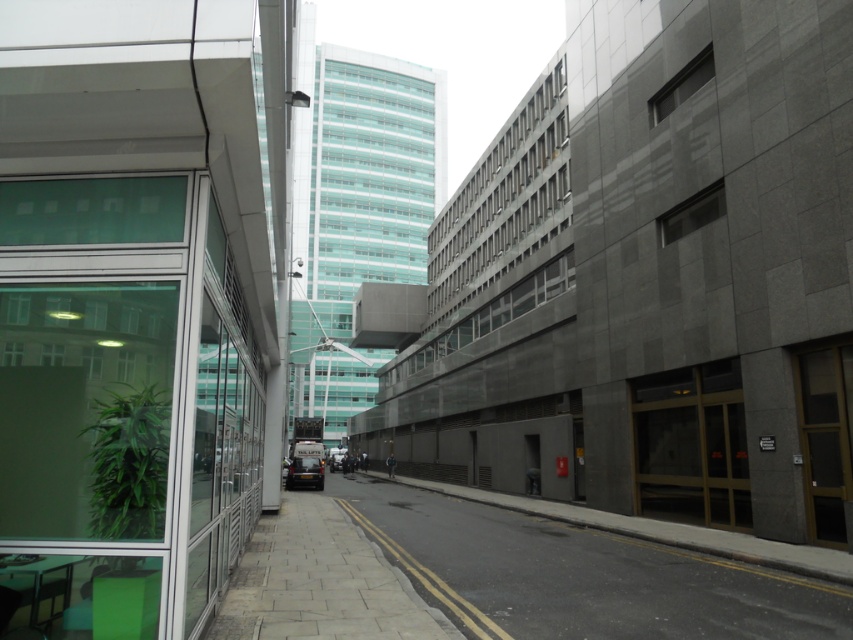
Between smooth concrete pavement at center and metallic silver van at center, which one appears on the left side from the viewer's perspective?

metallic silver van at center is more to the left.

Does smooth concrete pavement at center appear over metallic silver van at center?

Correct, smooth concrete pavement at center is located above metallic silver van at center.

Is point (350, 509) positioned behind point (314, 476)?

No, (350, 509) is closer to viewer.

Identify the location of smooth concrete pavement at center. click(x=579, y=577).

Consider the image. Does paved stone sidewalk at lower left come in front of metallic silver van at center?

Yes.

In order to click on paved stone sidewalk at lower left in this screenshot , I will do (x=321, y=582).

At what (x,y) coordinates should I click in order to perform the action: click on paved stone sidewalk at lower left. Please return your answer as a coordinate pair (x, y). Looking at the image, I should click on (321, 582).

Who is positioned more to the right, smooth concrete pavement at center or paved stone sidewalk at lower left?

From the viewer's perspective, smooth concrete pavement at center appears more on the right side.

Between smooth concrete pavement at center and paved stone sidewalk at lower left, which one is positioned higher?

paved stone sidewalk at lower left is above.

Who is more forward, (366, 483) or (277, 541)?

Positioned in front is point (277, 541).

This screenshot has height=640, width=853. In order to click on smooth concrete pavement at center in this screenshot , I will do `click(579, 577)`.